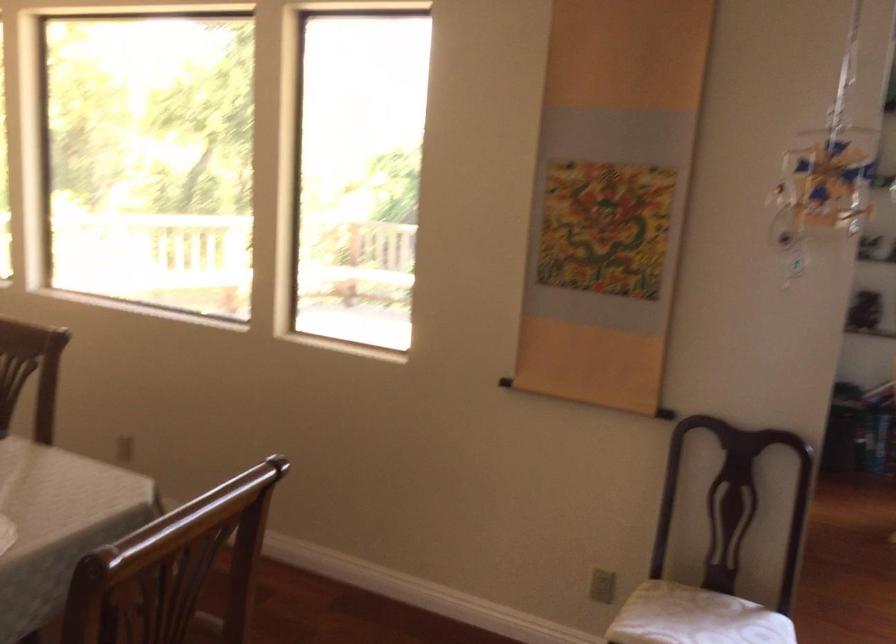
Where would you sit the chair sitting surface? Please return your answer as a coordinate pair (x, y).

(668, 614)